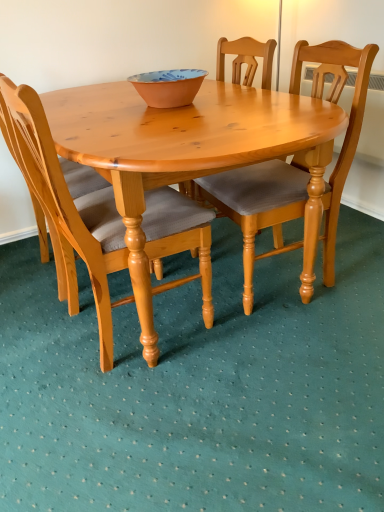
Question: In the image, is terracotta ceramic bowl at center positioned in front of or behind light wood/texture chair at center, which is the 1th chair in left-to-right order?

Choices:
 (A) front
 (B) behind

Answer: (B)

Question: Does point (170, 94) appear closer or farther from the camera than point (105, 239)?

Choices:
 (A) closer
 (B) farther

Answer: (B)

Question: Estimate the real-world distances between objects in this image. Which object is farther from the light brown wood chair at center, positioned as the first chair in right-to-left order?

Choices:
 (A) light wood/texture chair at center, which is the 1th chair in left-to-right order
 (B) terracotta ceramic bowl at center

Answer: (B)

Question: Considering the real-world distances, which object is farthest from the terracotta ceramic bowl at center?

Choices:
 (A) light brown wood chair at center, positioned as the first chair in right-to-left order
 (B) light wood/texture chair at center, which is the 2th chair from right to left

Answer: (A)